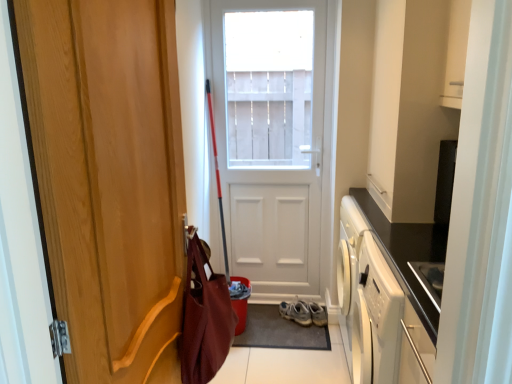
The width and height of the screenshot is (512, 384). Find the location of `blank space above dark gray rubber doormat at center (from a real-world perspective)`. blank space above dark gray rubber doormat at center (from a real-world perspective) is located at coordinates (283, 324).